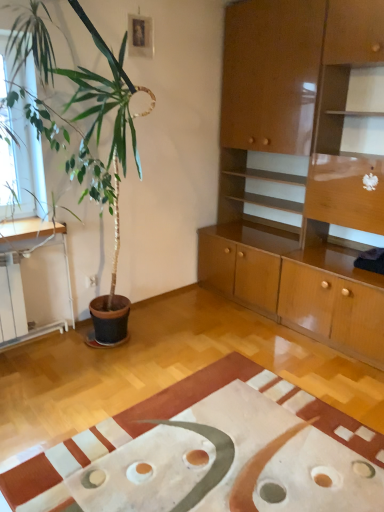
Question: Considering the positions of glossy wood cabinet at upper right and white matte rug at lower center in the image, is glossy wood cabinet at upper right wider or thinner than white matte rug at lower center?

Choices:
 (A) wide
 (B) thin

Answer: (B)

Question: From the image's perspective, is glossy wood cabinet at upper right above or below white matte rug at lower center?

Choices:
 (A) above
 (B) below

Answer: (A)

Question: Is glossy wood cabinet at upper right in front of or behind white matte rug at lower center in the image?

Choices:
 (A) behind
 (B) front

Answer: (A)

Question: From the image's perspective, is white matte rug at lower center above or below glossy wood cabinet at upper right?

Choices:
 (A) below
 (B) above

Answer: (A)

Question: From a real-world perspective, is white matte rug at lower center physically located above or below glossy wood cabinet at upper right?

Choices:
 (A) above
 (B) below

Answer: (B)

Question: Is white matte rug at lower center to the left or to the right of glossy wood cabinet at upper right in the image?

Choices:
 (A) right
 (B) left

Answer: (B)

Question: Looking at the image, does white matte rug at lower center seem bigger or smaller compared to glossy wood cabinet at upper right?

Choices:
 (A) small
 (B) big

Answer: (A)